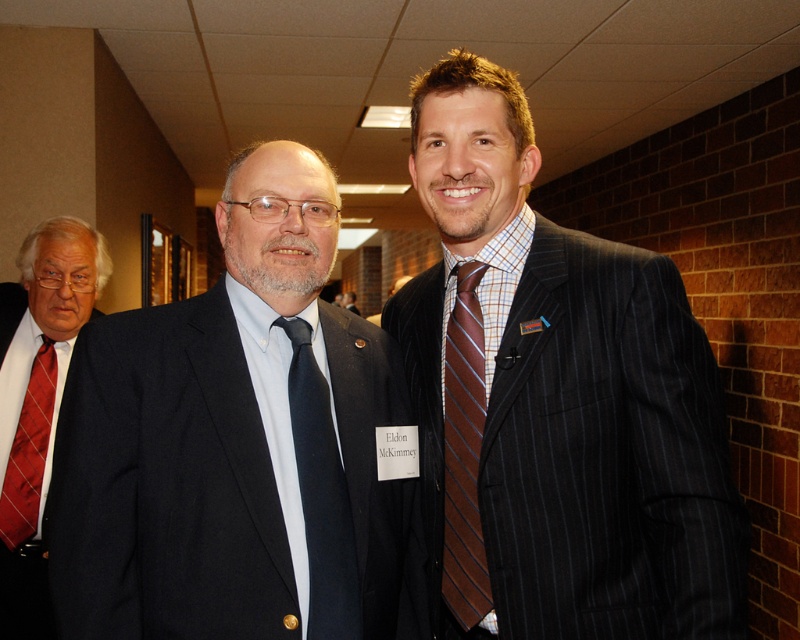
Does red textured tie at left appear over brown striped tie at center?

No.

Which of these two, red textured tie at left or brown striped tie at center, stands shorter?

brown striped tie at center is shorter.

Is point (0, 394) positioned before point (478, 602)?

No, it is behind (478, 602).

Where is `red textured tie at left`? The image size is (800, 640). red textured tie at left is located at coordinates (38, 401).

Does pinstriped suit at center have a smaller size compared to matte black tie at center?

No.

Consider the image. Which is below, pinstriped suit at center or matte black tie at center?

matte black tie at center is lower down.

In order to click on pinstriped suit at center in this screenshot , I will do `click(556, 401)`.

Can you confirm if red textured tie at left is positioned below matte black tie at center?

Indeed, red textured tie at left is positioned under matte black tie at center.

Find the location of a particular element. red textured tie at left is located at coordinates pos(38,401).

Between point (17, 300) and point (332, 604), which one is positioned behind?

The point (17, 300) is behind.

I want to click on red textured tie at left, so click(x=38, y=401).